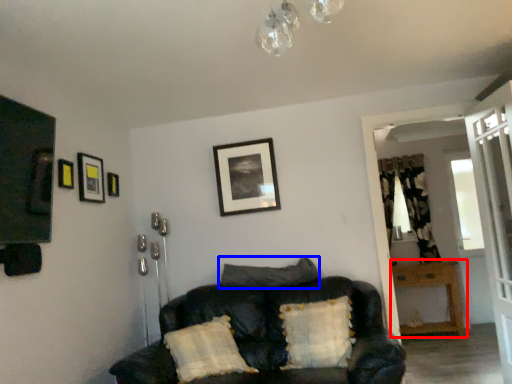
Question: Which object appears farthest to the camera in this image, table (highlighted by a red box) or pillow (highlighted by a blue box)?

Choices:
 (A) table
 (B) pillow

Answer: (A)